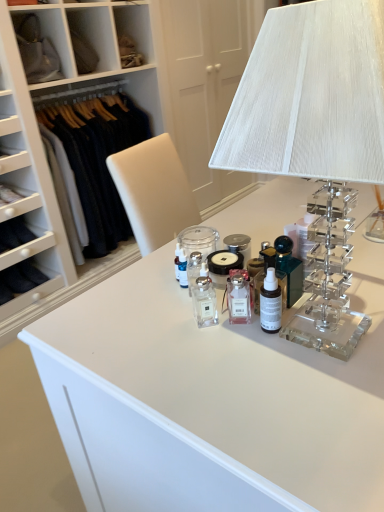
At what (x,y) coordinates should I click in order to perform the action: click on satin black bottle at center, which is counted as the 2th toiletry, starting from the left. Please return your answer as a coordinate pair (x, y). The height and width of the screenshot is (512, 384). Looking at the image, I should click on (270, 303).

Image resolution: width=384 pixels, height=512 pixels. What do you see at coordinates (204, 298) in the screenshot? I see `clear glass bottle at center, the 1th toiletry from the left` at bounding box center [204, 298].

At what (x,y) coordinates should I click in order to perform the action: click on clear glass bottle at center, the 1th toiletry from the left. Please return your answer as a coordinate pair (x, y). Looking at the image, I should click on (204, 298).

What do you see at coordinates (98, 159) in the screenshot? Image resolution: width=384 pixels, height=512 pixels. I see `dark wool sweater at left` at bounding box center [98, 159].

Locate an element on the screen. The width and height of the screenshot is (384, 512). dark wool sweater at left is located at coordinates (98, 159).

The height and width of the screenshot is (512, 384). What are the coordinates of `satin black bottle at center, the first toiletry positioned from the right` in the screenshot? It's located at (270, 303).

Looking at their sizes, would you say dark wool sweater at left is wider or thinner than satin black bottle at center, the first toiletry positioned from the right?

Clearly, dark wool sweater at left has more width compared to satin black bottle at center, the first toiletry positioned from the right.

Which is in front, point (135, 131) or point (269, 331)?

The point (269, 331) is closer to the camera.

From the picture: Is dark wool sweater at left facing towards satin black bottle at center, the first toiletry positioned from the right?

Yes, dark wool sweater at left is aimed at satin black bottle at center, the first toiletry positioned from the right.

Is dark wool sweater at left further to the viewer compared to satin black bottle at center, the first toiletry positioned from the right?

Yes, dark wool sweater at left is further from the viewer.

From the image's perspective, relative to satin black bottle at center, the first toiletry positioned from the right, is clear acrylic table lamp at upper right above or below?

Based on their image positions, clear acrylic table lamp at upper right is located above satin black bottle at center, the first toiletry positioned from the right.

Is clear acrylic table lamp at upper right facing away from satin black bottle at center, the first toiletry positioned from the right?

Yes, clear acrylic table lamp at upper right is facing away from satin black bottle at center, the first toiletry positioned from the right.

Can you confirm if clear acrylic table lamp at upper right is smaller than satin black bottle at center, the first toiletry positioned from the right?

No, clear acrylic table lamp at upper right is not smaller than satin black bottle at center, the first toiletry positioned from the right.

Can you confirm if clear acrylic table lamp at upper right is wider than satin black bottle at center, which is counted as the 2th toiletry, starting from the left?

Correct, the width of clear acrylic table lamp at upper right exceeds that of satin black bottle at center, which is counted as the 2th toiletry, starting from the left.

Does clear glass bottle at center, the 1th toiletry from the left, lie behind dark wool sweater at left?

No.

Is clear glass bottle at center, the 1th toiletry from the left, facing towards dark wool sweater at left?

No, clear glass bottle at center, the 1th toiletry from the left, is not oriented towards dark wool sweater at left.

Considering the sizes of clear glass bottle at center, the 1th toiletry from the left, and dark wool sweater at left in the image, is clear glass bottle at center, the 1th toiletry from the left, bigger or smaller than dark wool sweater at left?

Considering their sizes, clear glass bottle at center, the 1th toiletry from the left, takes up less space than dark wool sweater at left.

How different are the orientations of clear glass bottle at center, the 1th toiletry from the left, and dark wool sweater at left in degrees?

There is a 89.5-degree angle between the facing directions of clear glass bottle at center, the 1th toiletry from the left, and dark wool sweater at left.

Is clear glass bottle at center, which ranks as the 2th toiletry in right-to-left order, positioned with its back to satin black bottle at center, which is counted as the 2th toiletry, starting from the left?

No, satin black bottle at center, which is counted as the 2th toiletry, starting from the left, is not at the back of clear glass bottle at center, which ranks as the 2th toiletry in right-to-left order.

Considering the sizes of objects clear glass bottle at center, which ranks as the 2th toiletry in right-to-left order, and satin black bottle at center, which is counted as the 2th toiletry, starting from the left, in the image provided, who is shorter, clear glass bottle at center, which ranks as the 2th toiletry in right-to-left order, or satin black bottle at center, which is counted as the 2th toiletry, starting from the left,?

clear glass bottle at center, which ranks as the 2th toiletry in right-to-left order.

Considering the positions of objects clear glass bottle at center, which ranks as the 2th toiletry in right-to-left order, and satin black bottle at center, the first toiletry positioned from the right, in the image provided, who is more to the left, clear glass bottle at center, which ranks as the 2th toiletry in right-to-left order, or satin black bottle at center, the first toiletry positioned from the right,?

Positioned to the left is clear glass bottle at center, which ranks as the 2th toiletry in right-to-left order.

Is satin black bottle at center, which is counted as the 2th toiletry, starting from the left, wider than clear acrylic table lamp at upper right?

No, satin black bottle at center, which is counted as the 2th toiletry, starting from the left, is not wider than clear acrylic table lamp at upper right.

Is satin black bottle at center, the first toiletry positioned from the right, turned away from clear acrylic table lamp at upper right?

Yes, clear acrylic table lamp at upper right is at the back of satin black bottle at center, the first toiletry positioned from the right.

Is satin black bottle at center, the first toiletry positioned from the right, smaller than clear acrylic table lamp at upper right?

Yes.

Which object is more forward, satin black bottle at center, which is counted as the 2th toiletry, starting from the left, or clear acrylic table lamp at upper right?

clear acrylic table lamp at upper right is in front.

Between clear acrylic table lamp at upper right and clear glass bottle at center, which ranks as the 2th toiletry in right-to-left order, which one has larger size?

With larger size is clear acrylic table lamp at upper right.

Measure the distance from clear acrylic table lamp at upper right to clear glass bottle at center, which ranks as the 2th toiletry in right-to-left order.

They are 48.21 centimeters apart.

Does point (333, 111) appear closer or farther from the camera than point (206, 304)?

Point (333, 111) is closer to the camera than point (206, 304).

Which object is further away from the camera, clear acrylic table lamp at upper right or clear glass bottle at center, which ranks as the 2th toiletry in right-to-left order?

clear glass bottle at center, which ranks as the 2th toiletry in right-to-left order, is further away from the camera.

Can you confirm if dark wool sweater at left is shorter than clear glass bottle at center, the 1th toiletry from the left?

No, dark wool sweater at left is not shorter than clear glass bottle at center, the 1th toiletry from the left.

From the image's perspective, does dark wool sweater at left appear lower than clear glass bottle at center, which ranks as the 2th toiletry in right-to-left order?

No.

Can you see dark wool sweater at left touching clear glass bottle at center, the 1th toiletry from the left?

dark wool sweater at left and clear glass bottle at center, the 1th toiletry from the left, are clearly separated.

Does dark wool sweater at left come in front of clear glass bottle at center, which ranks as the 2th toiletry in right-to-left order?

That is False.

Starting from the dark wool sweater at left, which toiletry is the 2nd one to the right? Please provide its 2D coordinates.

[(270, 303)]

Locate an element on the screen. table lamp above the satin black bottle at center, which is counted as the 2th toiletry, starting from the left (from the image's perspective) is located at coordinates (314, 128).

From the image, which object appears to be farther from clear acrylic table lamp at upper right, clear glass bottle at center, which ranks as the 2th toiletry in right-to-left order, or dark wool sweater at left?

dark wool sweater at left.

Estimate the real-world distances between objects in this image. Which object is closer to clear glass bottle at center, which ranks as the 2th toiletry in right-to-left order, satin black bottle at center, which is counted as the 2th toiletry, starting from the left, or clear acrylic table lamp at upper right?

satin black bottle at center, which is counted as the 2th toiletry, starting from the left, is positioned closer to the anchor clear glass bottle at center, which ranks as the 2th toiletry in right-to-left order.

Which object lies nearer to the anchor point clear glass bottle at center, the 1th toiletry from the left, satin black bottle at center, which is counted as the 2th toiletry, starting from the left, or dark wool sweater at left?

satin black bottle at center, which is counted as the 2th toiletry, starting from the left.

Based on their spatial positions, is satin black bottle at center, the first toiletry positioned from the right, or dark wool sweater at left closer to clear acrylic table lamp at upper right?

The object closer to clear acrylic table lamp at upper right is satin black bottle at center, the first toiletry positioned from the right.

Considering their positions, is clear glass bottle at center, which ranks as the 2th toiletry in right-to-left order, positioned further to dark wool sweater at left than satin black bottle at center, which is counted as the 2th toiletry, starting from the left?

Among the two, satin black bottle at center, which is counted as the 2th toiletry, starting from the left, is located further to dark wool sweater at left.

When comparing their distances from satin black bottle at center, the first toiletry positioned from the right, does clear acrylic table lamp at upper right or dark wool sweater at left seem closer?

Based on the image, clear acrylic table lamp at upper right appears to be nearer to satin black bottle at center, the first toiletry positioned from the right.

Which object lies nearer to the anchor point satin black bottle at center, the first toiletry positioned from the right, dark wool sweater at left or clear acrylic table lamp at upper right?

Based on the image, clear acrylic table lamp at upper right appears to be nearer to satin black bottle at center, the first toiletry positioned from the right.

From the image, which object appears to be nearer to clear acrylic table lamp at upper right, dark wool sweater at left or satin black bottle at center, which is counted as the 2th toiletry, starting from the left?

Among the two, satin black bottle at center, which is counted as the 2th toiletry, starting from the left, is located nearer to clear acrylic table lamp at upper right.

Locate an element on the screen. The image size is (384, 512). toiletry positioned between satin black bottle at center, the first toiletry positioned from the right, and dark wool sweater at left from near to far is located at coordinates (204, 298).

Identify the location of toiletry between clear acrylic table lamp at upper right and clear glass bottle at center, which ranks as the 2th toiletry in right-to-left order, in the front-back direction. The height and width of the screenshot is (512, 384). (270, 303).